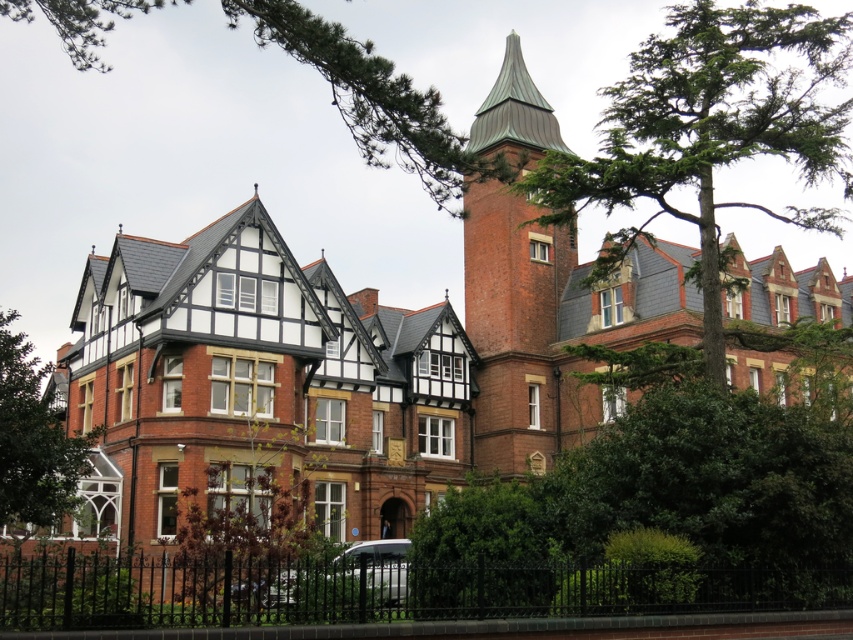
You are standing at the entrance of the building and want to know the exact location of the black wrought iron fence at lower center. What are its coordinates?

The coordinates of the black wrought iron fence at lower center are at point (380, 589).

You are a landscape architect planning to install a new pathway between the two green leafy trees. Given that the minimum required distance for such a pathway is 100 feet, will the existing distance between the green leafy tree at upper right and the green leafy tree at center allow for this pathway?

The green leafy tree at upper right and green leafy tree at center are 134.15 feet apart, which exceeds the minimum required distance of 100 feet. Therefore, the existing distance allows for the pathway to be installed between them.